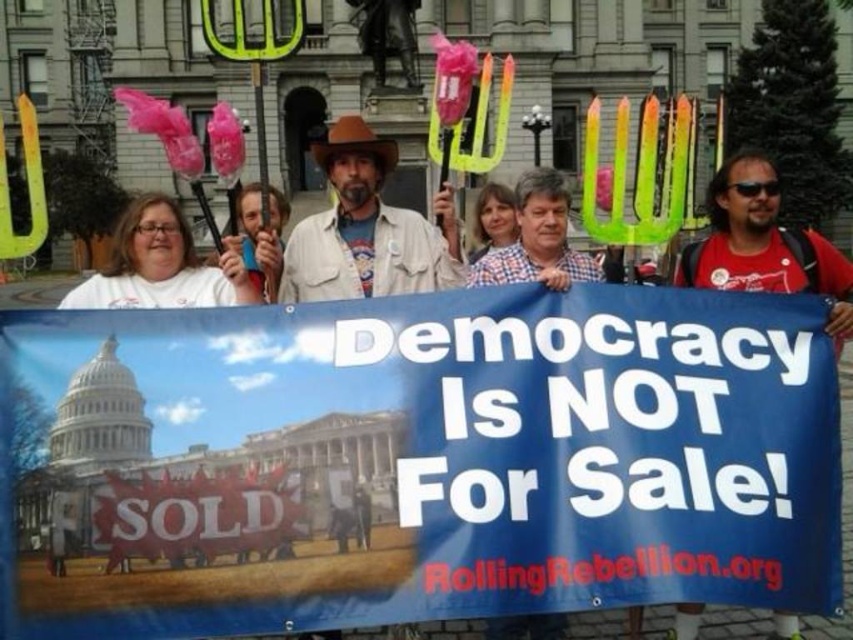
Is the position of red matte shirt at center more distant than that of checkered shirt at center?

No, it is not.

Is point (761, 260) positioned after point (532, 186)?

That is False.

Which is in front, point (761, 237) or point (554, 621)?

Positioned in front is point (554, 621).

Locate an element on the screen. red matte shirt at center is located at coordinates (764, 244).

Between blue fabric banner at center and red matte shirt at center, which one has more height?

red matte shirt at center is taller.

This screenshot has height=640, width=853. Find the location of `blue fabric banner at center`. blue fabric banner at center is located at coordinates (415, 460).

Does blue fabric banner at center come behind checkered shirt at center?

No, blue fabric banner at center is closer to the viewer.

Is blue fabric banner at center closer to the viewer compared to checkered shirt at center?

Yes, it is.

Is point (612, 588) behind point (558, 225)?

No, it is not.

Locate an element on the screen. blue fabric banner at center is located at coordinates 415,460.